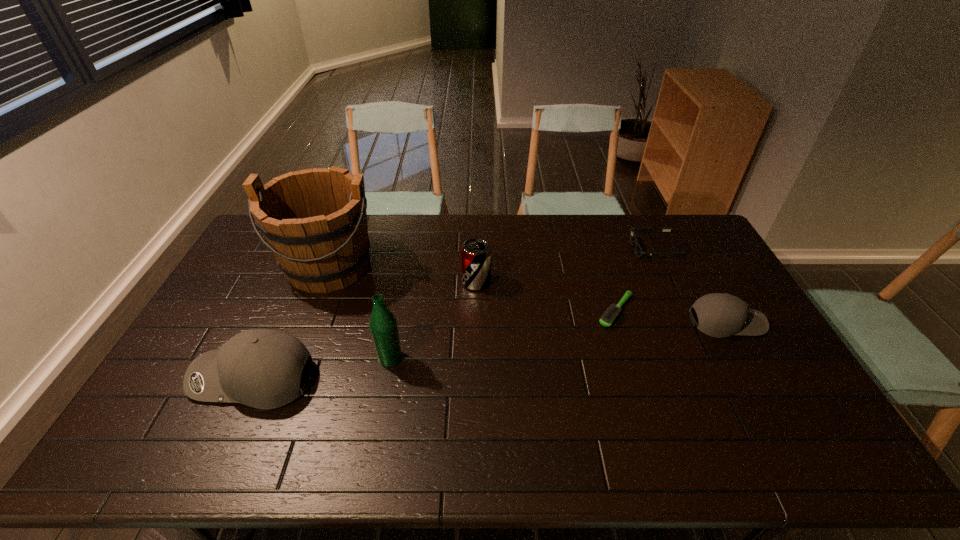
Where is `object that is positioned at the near edge`? object that is positioned at the near edge is located at coordinates (262, 368).

Where is `baseball cap that is at the left edge`? baseball cap that is at the left edge is located at coordinates point(262,368).

Locate an element on the screen. The height and width of the screenshot is (540, 960). wine bucket present at the left edge is located at coordinates (314, 221).

This screenshot has height=540, width=960. Identify the location of baseball cap present at the right edge. (720, 315).

Where is `sunglasses located in the right edge section of the desktop`? The width and height of the screenshot is (960, 540). sunglasses located in the right edge section of the desktop is located at coordinates (638, 250).

Identify the location of object that is at the far left corner. This screenshot has height=540, width=960. (314, 221).

What are the coordinates of `object located in the near left corner section of the desktop` in the screenshot? It's located at (262, 368).

Image resolution: width=960 pixels, height=540 pixels. I want to click on object that is at the far right corner, so click(638, 250).

This screenshot has height=540, width=960. I want to click on free space at the far edge of the desktop, so click(x=618, y=241).

Locate an element on the screen. The height and width of the screenshot is (540, 960). free space at the near edge of the desktop is located at coordinates (306, 397).